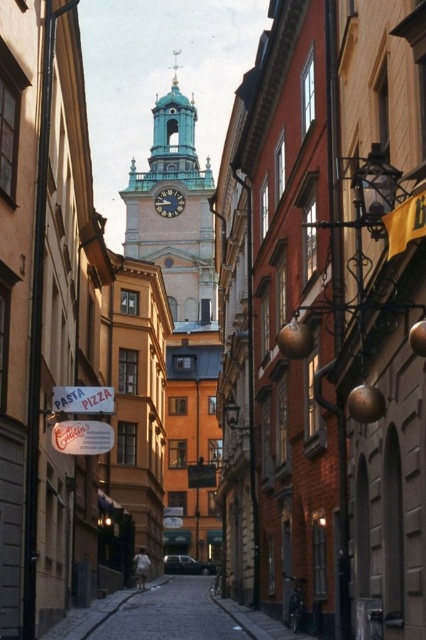
Question: Which point appears closest to the camera in this image?

Choices:
 (A) (152, 168)
 (B) (178, 202)

Answer: (B)

Question: Can you confirm if green stone clock tower at center is positioned to the left of green patina clock at center?

Choices:
 (A) no
 (B) yes

Answer: (A)

Question: Which point is closer to the camera?

Choices:
 (A) (172, 209)
 (B) (127, 195)

Answer: (A)

Question: Where is green stone clock tower at center located in relation to green patina clock at center in the image?

Choices:
 (A) above
 (B) below

Answer: (A)

Question: Is green stone clock tower at center to the left of green patina clock at center from the viewer's perspective?

Choices:
 (A) yes
 (B) no

Answer: (B)

Question: Which point is farther from the camera taking this photo?

Choices:
 (A) (175, 193)
 (B) (181, 314)

Answer: (A)